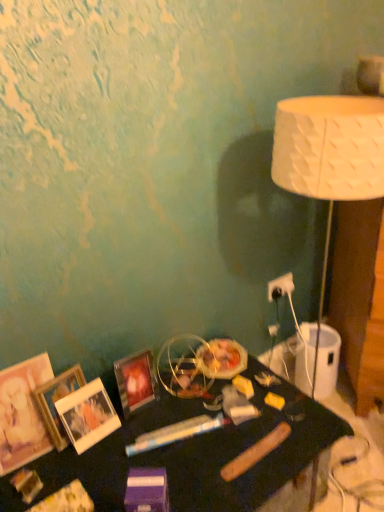
Question: Does point (x=276, y=282) appear closer or farther from the camera than point (x=71, y=438)?

Choices:
 (A) closer
 (B) farther

Answer: (B)

Question: Looking at the image, does white plastic electric outlet at upper right seem bigger or smaller compared to white matte picture frame at lower left, which is the 2th picture frame in right-to-left order?

Choices:
 (A) small
 (B) big

Answer: (A)

Question: Which object is positioned closest to the matte wooden picture frame at left, which ranks as the fourth picture frame in right-to-left order?

Choices:
 (A) black glossy table at lower center
 (B) white plastic electric outlet at upper right
 (C) wooden photo frame at lower left, placed as the second picture frame when sorted from left to right
 (D) matte glass picture frame at lower left, which is the 4th picture frame in left-to-right order
 (E) white textured lampshade at right

Answer: (C)

Question: Estimate the real-world distances between objects in this image. Which object is farther from the matte wooden picture frame at left, positioned as the 1th picture frame in left-to-right order?

Choices:
 (A) white textured lampshade at right
 (B) matte glass picture frame at lower left, which is the 4th picture frame in left-to-right order
 (C) black glossy table at lower center
 (D) white matte picture frame at lower left, the third picture frame viewed from the left
 (E) wooden photo frame at lower left, marked as the 3th picture frame in a right-to-left arrangement

Answer: (A)